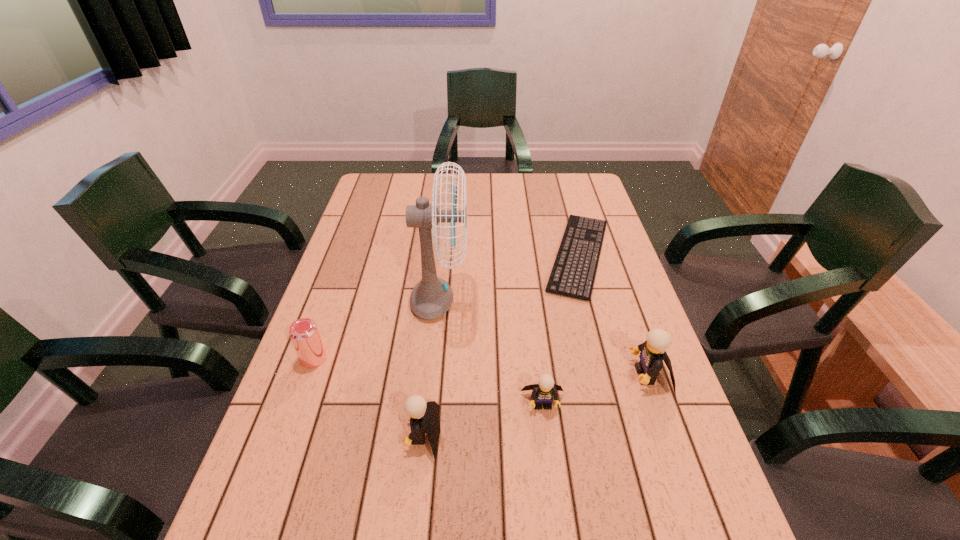
At what (x,y) coordinates should I click in order to perform the action: click on vacant space situated on the front-facing side of the leftmost Lego. Please return your answer as a coordinate pair (x, y). Looking at the image, I should click on tap(354, 434).

This screenshot has height=540, width=960. Find the location of `free space located 0.200m on the front-facing side of the second Lego from left to right`. free space located 0.200m on the front-facing side of the second Lego from left to right is located at coordinates (556, 510).

Where is `blank area located on the front-facing side of the tallest Lego`? blank area located on the front-facing side of the tallest Lego is located at coordinates (504, 375).

Locate an element on the screen. This screenshot has width=960, height=540. vacant space located 0.080m on the front-facing side of the tallest Lego is located at coordinates (596, 375).

Image resolution: width=960 pixels, height=540 pixels. I want to click on vacant space located 0.340m on the front-facing side of the tallest Lego, so click(x=487, y=375).

At what (x,y) coordinates should I click in order to perform the action: click on vacant space located 0.110m on the front-facing side of the fan. Please return your answer as a coordinate pair (x, y). Looking at the image, I should click on (508, 303).

Identify the location of vacant space positioned on the front of the shortest object. (605, 353).

At what (x,y) coordinates should I click in order to perform the action: click on vacant space located on the back of the beer can. Please return your answer as a coordinate pair (x, y). This screenshot has height=540, width=960. Looking at the image, I should click on (332, 307).

The height and width of the screenshot is (540, 960). Identify the location of object located at the left edge. (304, 333).

This screenshot has width=960, height=540. I want to click on Lego that is at the right edge, so click(653, 351).